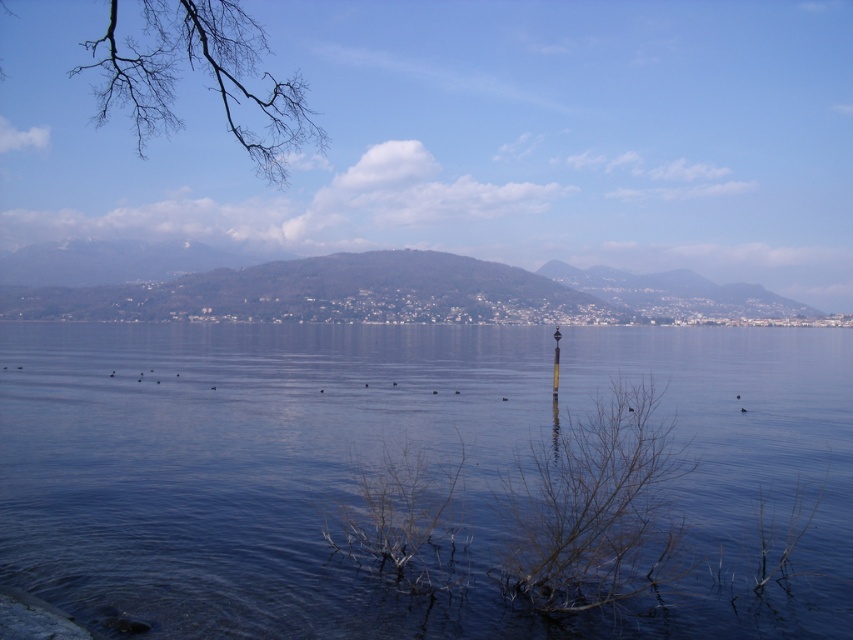
Question: Which object is farther from the camera taking this photo?

Choices:
 (A) bare branches at upper left
 (B) bare branches at center
 (C) transparent water at center
 (D) green grassy hill at center

Answer: (D)

Question: Is transparent water at center to the left of green grassy hill at center from the viewer's perspective?

Choices:
 (A) no
 (B) yes

Answer: (A)

Question: Can you confirm if green grassy hill at center is smaller than bare branches at center?

Choices:
 (A) yes
 (B) no

Answer: (B)

Question: Which object is positioned closest to the transparent water at center?

Choices:
 (A) bare branches at center
 (B) green grassy hill at center
 (C) bare branches at upper left

Answer: (A)

Question: Is transparent water at center thinner than bare branches at center?

Choices:
 (A) yes
 (B) no

Answer: (B)

Question: Among these points, which one is farthest from the camera?

Choices:
 (A) (440, 252)
 (B) (575, 552)
 (C) (161, 32)
 (D) (697, 518)

Answer: (A)